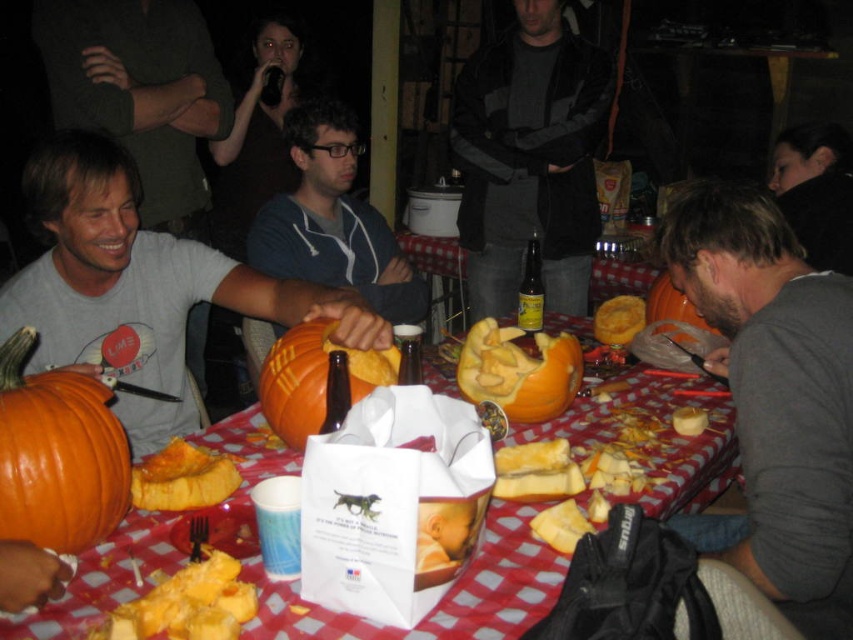
You are standing in front of the table where people are carving pumpkins. There are two points marked on the table. The first point is at coordinate point (x=836, y=454) and the second point is at coordinate point (x=321, y=227). Which point is closer to you?

Point (x=836, y=454) is closer to the camera than point (x=321, y=227), so the first point is closer to you.

You are standing at the entrance of the room and want to find the gray cotton shirt at center. Based on the coordinates provided, in which direction should you look to locate it?

The gray cotton shirt at center is located at point 0.623 on the horizontal axis and 0.909 on the vertical axis. Since the coordinates are given as fractions of the image dimensions, you should look towards the lower right area of the image to find it.

You are organizing a Halloween party and need to arrange items on a narrow shelf. The gray cotton shirt at center and the yellow soft cheese at center are both to be placed on the shelf. Based on their sizes, which item should you place first to ensure they both fit?

The gray cotton shirt at center is wider than the yellow soft cheese at center. To fit both on the shelf, place the wider gray cotton shirt at center first, then the narrower yellow soft cheese at center.